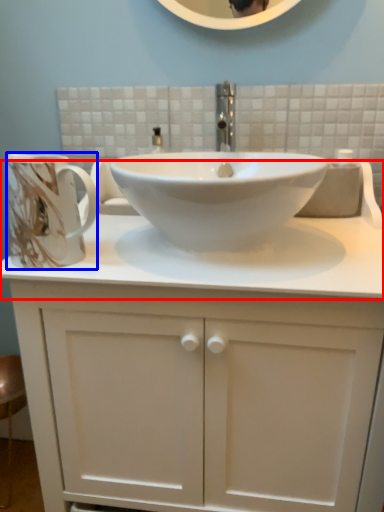
Question: Which object appears closest to the camera in this image, counter top (highlighted by a red box) or mug (highlighted by a blue box)?

Choices:
 (A) counter top
 (B) mug

Answer: (A)